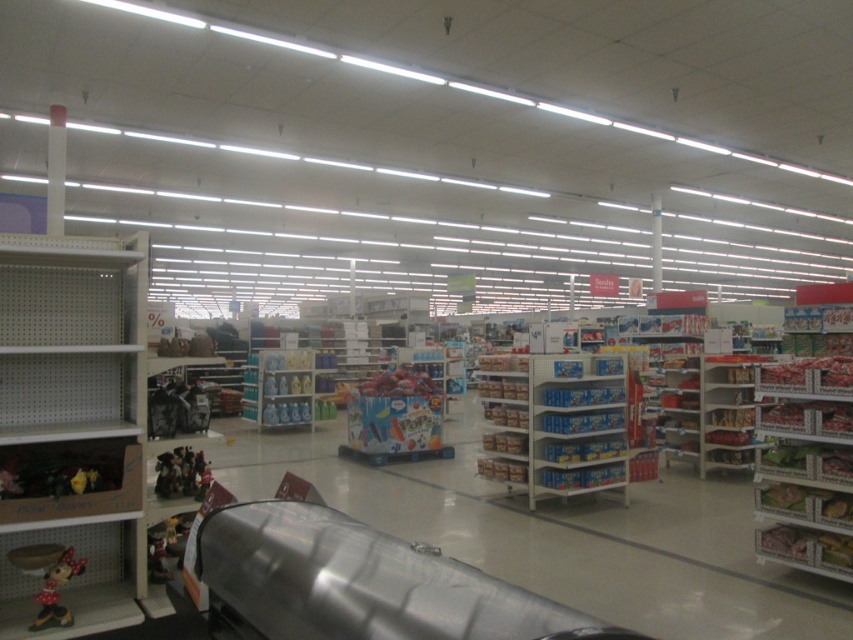
You are a store employee who needs to place a new display featuring the matte plastic minnie mouse at lower left next to the metallic silver shelves at right. Based on the current layout, can you position them side by side without moving any other items?

The metallic silver shelves at right is positioned on the right side of matte plastic minnie mouse at lower left, so they are already positioned side by side. Therefore, you can place the display without moving other items.

Where is the white matte shelf at left located in the image?

The white matte shelf at left is located at point [71,419].

You are a store employee who needs to place a new item on the highest shelf you can reach. You can reach up to 1.8 meters. The white matte shelf at left is 1.7 meters tall, and the metallic silver shelves at right are 1.6 meters tall. Which shelf should you choose?

The white matte shelf at left is 1.7 meters tall, so you can reach it since it is within your 1.8 meters reach limit. The metallic silver shelves at right are 1.6 meters tall, which you can also reach. However, since the white matte shelf at left is taller, it is the highest shelf you can reach.